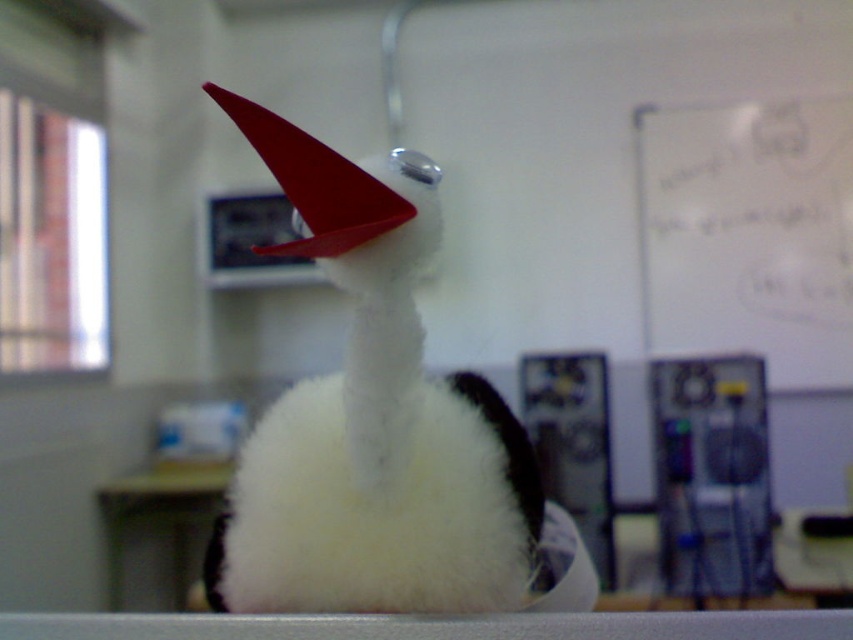
This screenshot has width=853, height=640. I want to click on white matte board at upper right, so click(x=747, y=232).

What do you see at coordinates (747, 232) in the screenshot? I see `white matte board at upper right` at bounding box center [747, 232].

Who is more forward, (764,227) or (167,529)?

Positioned in front is point (167,529).

Where is `white matte board at upper right`? The height and width of the screenshot is (640, 853). white matte board at upper right is located at coordinates (747, 232).

Does point (233, 513) come behind point (169, 506)?

That is False.

The height and width of the screenshot is (640, 853). What are the coordinates of `white fluffy fur at center` in the screenshot? It's located at (379, 509).

Is white fluffy fur at center above white matte board at upper right?

Actually, white fluffy fur at center is below white matte board at upper right.

Which is below, white fluffy fur at center or white matte board at upper right?

white fluffy fur at center is lower down.

Which is behind, point (358, 548) or point (840, 228)?

Point (840, 228)

I want to click on white fluffy fur at center, so click(379, 509).